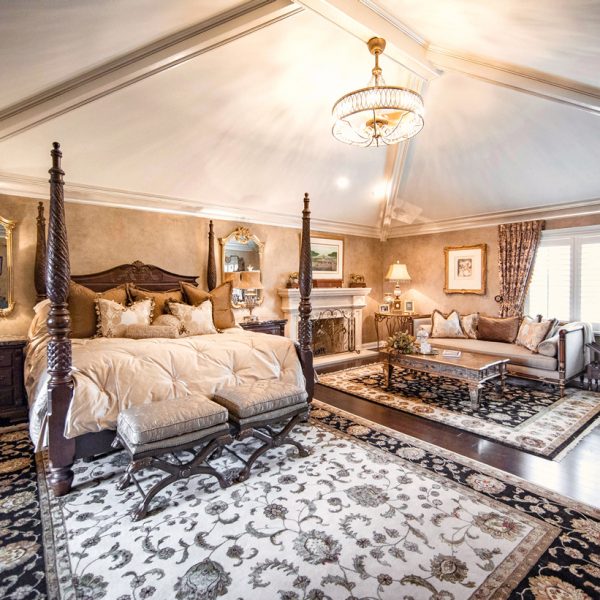
This screenshot has height=600, width=600. Find the location of `seat`. seat is located at coordinates (185, 416).